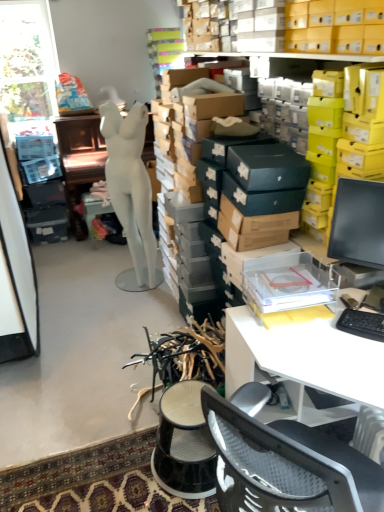
Question: Does transparent glass window at upper left have a greater width compared to white matte mannequin at center?

Choices:
 (A) yes
 (B) no

Answer: (B)

Question: Are transparent glass window at upper left and white matte mannequin at center far apart?

Choices:
 (A) no
 (B) yes

Answer: (B)

Question: Is transparent glass window at upper left not within white matte mannequin at center?

Choices:
 (A) yes
 (B) no

Answer: (A)

Question: From the image's perspective, is transparent glass window at upper left above white matte mannequin at center?

Choices:
 (A) yes
 (B) no

Answer: (A)

Question: Considering the relative sizes of transparent glass window at upper left and white matte mannequin at center in the image provided, is transparent glass window at upper left taller than white matte mannequin at center?

Choices:
 (A) no
 (B) yes

Answer: (A)

Question: Would you say black plastic keyboard at right is inside or outside white plastic desk at lower right?

Choices:
 (A) outside
 (B) inside

Answer: (B)

Question: From their relative heights in the image, would you say black plastic keyboard at right is taller or shorter than white plastic desk at lower right?

Choices:
 (A) short
 (B) tall

Answer: (A)

Question: From a real-world perspective, relative to white plastic desk at lower right, is black plastic keyboard at right vertically above or below?

Choices:
 (A) below
 (B) above

Answer: (B)

Question: In the image, is black plastic keyboard at right on the left side or the right side of white plastic desk at lower right?

Choices:
 (A) left
 (B) right

Answer: (B)

Question: Is white plastic desk at lower right bigger or smaller than white matte mannequin at center?

Choices:
 (A) small
 (B) big

Answer: (A)

Question: In the image, is white plastic desk at lower right on the left side or the right side of white matte mannequin at center?

Choices:
 (A) left
 (B) right

Answer: (B)

Question: From the image's perspective, is white plastic desk at lower right positioned above or below white matte mannequin at center?

Choices:
 (A) above
 (B) below

Answer: (B)

Question: Is white plastic desk at lower right in front of or behind white matte mannequin at center in the image?

Choices:
 (A) front
 (B) behind

Answer: (A)

Question: Is transparent glass window at upper left to the left or to the right of black plastic stool at center in the image?

Choices:
 (A) left
 (B) right

Answer: (A)

Question: From their relative heights in the image, would you say transparent glass window at upper left is taller or shorter than black plastic stool at center?

Choices:
 (A) short
 (B) tall

Answer: (B)